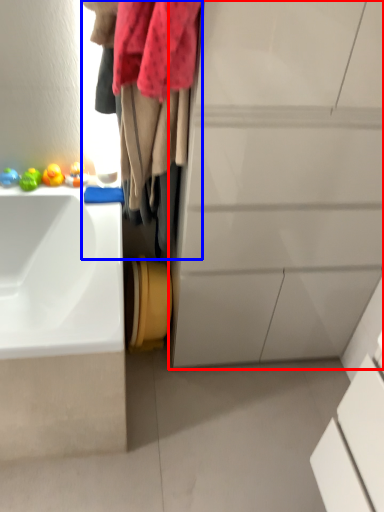
Question: Which object appears farthest to the camera in this image, bathroom cabinet (highlighted by a red box) or laundry (highlighted by a blue box)?

Choices:
 (A) bathroom cabinet
 (B) laundry

Answer: (B)